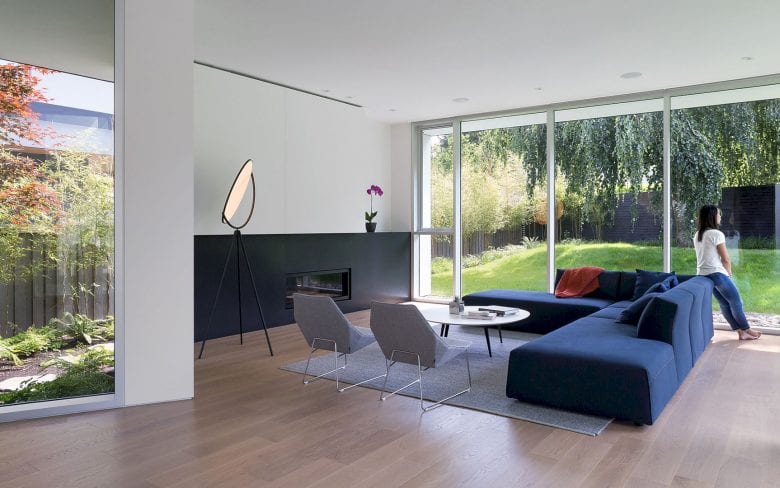
Identify the location of coffee table. (x=458, y=317).